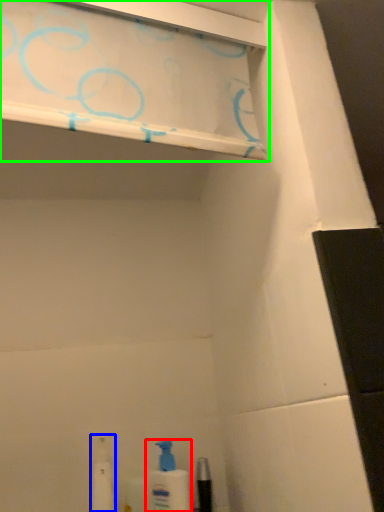
Question: Which is farther away from cleaning product (highlighted by a red box)? toiletry (highlighted by a blue box) or shelf (highlighted by a green box)?

Choices:
 (A) toiletry
 (B) shelf

Answer: (B)